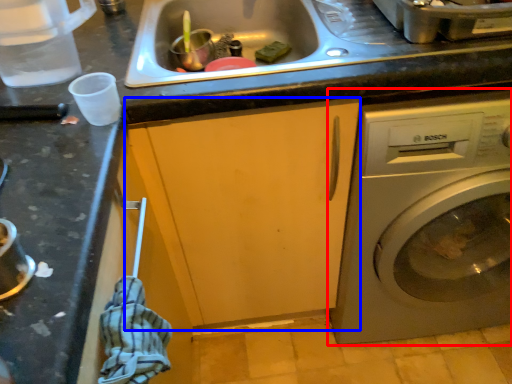
Question: Among these objects, which one is nearest to the camera, washing machine (highlighted by a red box) or cabinetry (highlighted by a blue box)?

Choices:
 (A) washing machine
 (B) cabinetry

Answer: (A)